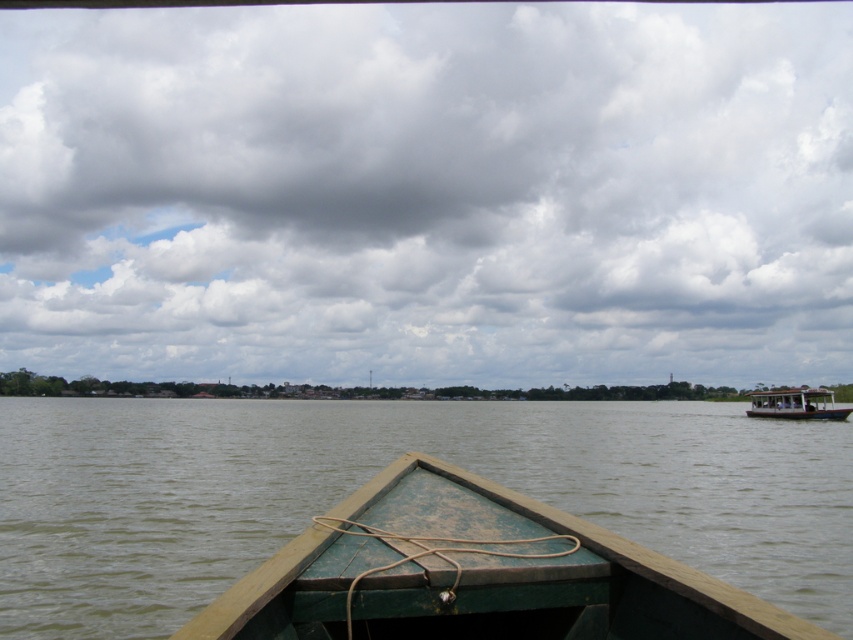
Who is shorter, cloudy sky at upper center or green weathered wood boat at center?

green weathered wood boat at center

Which is behind, point (634, 380) or point (561, 620)?

The point (634, 380) is behind.

Does point (492, 49) come farther from viewer compared to point (409, 564)?

That is True.

The width and height of the screenshot is (853, 640). I want to click on cloudy sky at upper center, so click(x=428, y=193).

Locate an element on the screen. green weathered wood boat at center is located at coordinates [476, 573].

Can you confirm if green weathered wood boat at center is bigger than white wooden boat at right?

No.

Is point (543, 568) farther from camera compared to point (762, 410)?

That is False.

At what (x,y) coordinates should I click in order to perform the action: click on green weathered wood boat at center. Please return your answer as a coordinate pair (x, y). Looking at the image, I should click on (476, 573).

Which is more to the left, cloudy sky at upper center or white wooden boat at right?

cloudy sky at upper center

Consider the image. Is cloudy sky at upper center to the left of white wooden boat at right from the viewer's perspective?

Correct, you'll find cloudy sky at upper center to the left of white wooden boat at right.

Does point (325, 202) lie behind point (763, 390)?

That is True.

The height and width of the screenshot is (640, 853). Identify the location of cloudy sky at upper center. (428, 193).